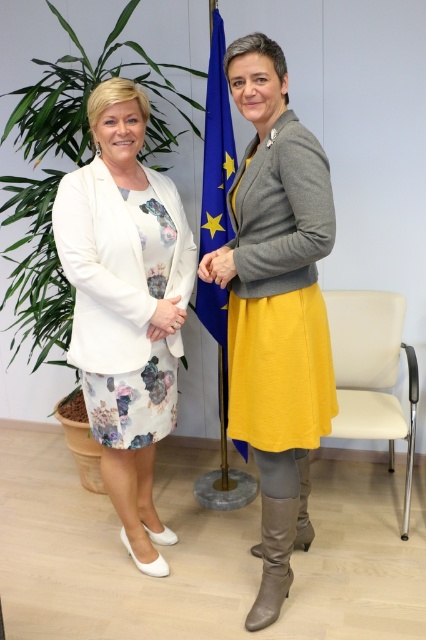
Consider the image. You are taking a photo of the two women in the scene. You want to focus on the point at point (281, 588) and point (255, 548). Which point is closer to your camera?

Point (281, 588) is closer to the camera than point (255, 548).

You are a photographer setting up for an event. You need to decide whether to place a small tripod under the blue fabric flag at center or the leather boot at lower center. Which object can accommodate the tripod based on size?

The blue fabric flag at center is larger in size than the leather boot at lower center, so the tripod should be placed under the blue fabric flag at center as it provides a larger surface area for stability.

You are a photographer setting up for a group photo. You need to ensure that the matte gray sweater at center and the leather boot at lower center are both in focus. The camera can only maintain sharp focus within a 15 inch range. Based on their current positions, will both objects be in focus?

The distance between the matte gray sweater at center and the leather boot at lower center is 17.55 inches, which exceeds the camera focus range of 15 inches. Therefore, both objects cannot be in focus simultaneously.